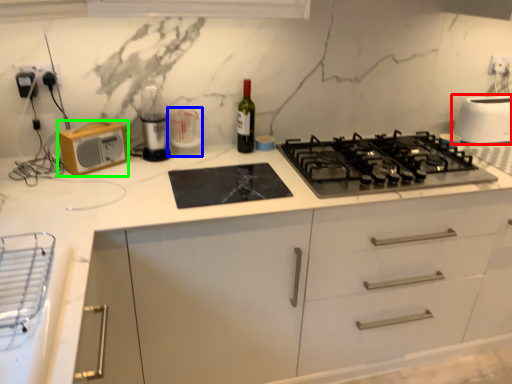
Question: Based on their relative distances, which object is farther from toaster (highlighted by a red box)? Choose from appliance (highlighted by a blue box) and kitchen appliance (highlighted by a green box).

Choices:
 (A) appliance
 (B) kitchen appliance

Answer: (B)